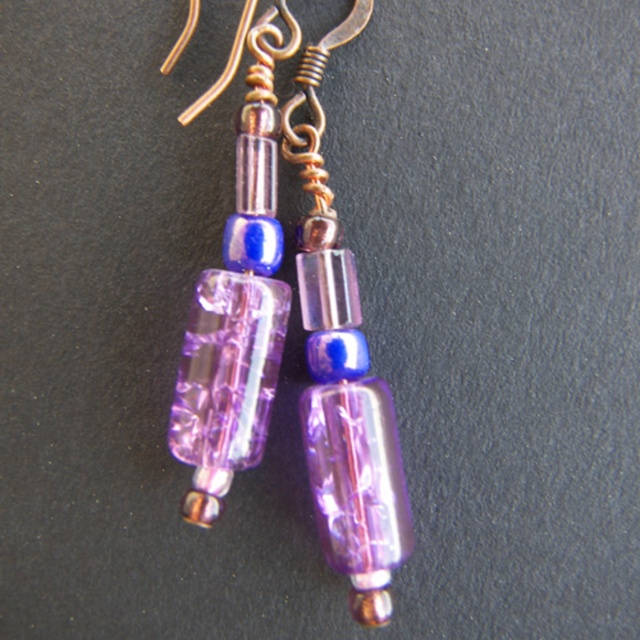
Which is above, transparent purple glass bead at center or translucent purple glass bead at center?

Positioned higher is translucent purple glass bead at center.

Does transparent purple glass bead at center appear on the left side of translucent purple glass bead at center?

Incorrect, transparent purple glass bead at center is not on the left side of translucent purple glass bead at center.

Locate an element on the screen. The height and width of the screenshot is (640, 640). transparent purple glass bead at center is located at coordinates (342, 374).